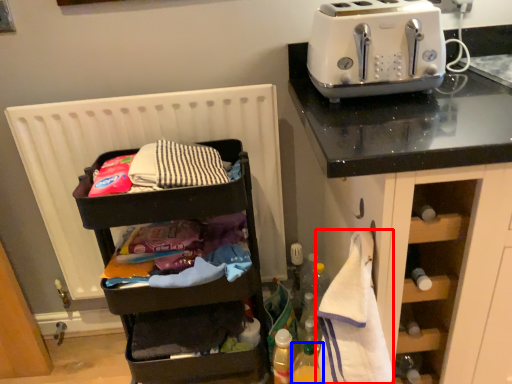
Question: Which of the following is the closest to the observer, clothe (highlighted by a red box) or bottle (highlighted by a blue box)?

Choices:
 (A) clothe
 (B) bottle

Answer: (A)